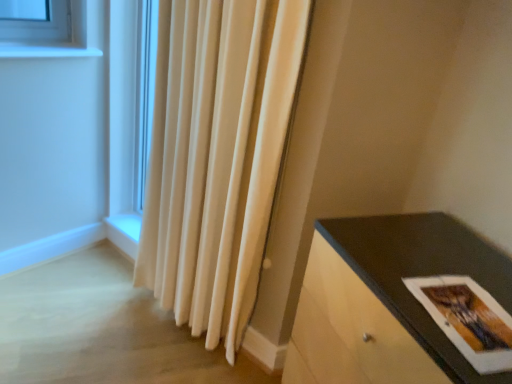
Question: Considering the relative sizes of white velvet curtain at center and matte paper postcard at lower right in the image provided, is white velvet curtain at center bigger than matte paper postcard at lower right?

Choices:
 (A) no
 (B) yes

Answer: (B)

Question: Could you tell me if white velvet curtain at center is turned towards matte paper postcard at lower right?

Choices:
 (A) yes
 (B) no

Answer: (B)

Question: Is matte paper postcard at lower right surrounded by white velvet curtain at center?

Choices:
 (A) no
 (B) yes

Answer: (A)

Question: Is white velvet curtain at center closer to camera compared to matte paper postcard at lower right?

Choices:
 (A) yes
 (B) no

Answer: (B)

Question: From the image's perspective, does white velvet curtain at center appear lower than matte paper postcard at lower right?

Choices:
 (A) no
 (B) yes

Answer: (A)

Question: Considering the relative positions of white velvet curtain at center and matte paper postcard at lower right in the image provided, is white velvet curtain at center behind matte paper postcard at lower right?

Choices:
 (A) yes
 (B) no

Answer: (A)

Question: Is matte black table at lower right touching matte paper postcard at lower right?

Choices:
 (A) yes
 (B) no

Answer: (B)

Question: From the image's perspective, is matte black table at lower right beneath matte paper postcard at lower right?

Choices:
 (A) yes
 (B) no

Answer: (A)

Question: Considering the relative sizes of matte black table at lower right and matte paper postcard at lower right in the image provided, is matte black table at lower right taller than matte paper postcard at lower right?

Choices:
 (A) no
 (B) yes

Answer: (B)

Question: Is matte black table at lower right at the left side of matte paper postcard at lower right?

Choices:
 (A) yes
 (B) no

Answer: (A)

Question: Does matte black table at lower right have a lesser height compared to matte paper postcard at lower right?

Choices:
 (A) no
 (B) yes

Answer: (A)

Question: From a real-world perspective, is matte black table at lower right on top of matte paper postcard at lower right?

Choices:
 (A) yes
 (B) no

Answer: (B)

Question: From a real-world perspective, is matte paper postcard at lower right on matte black table at lower right?

Choices:
 (A) no
 (B) yes

Answer: (B)